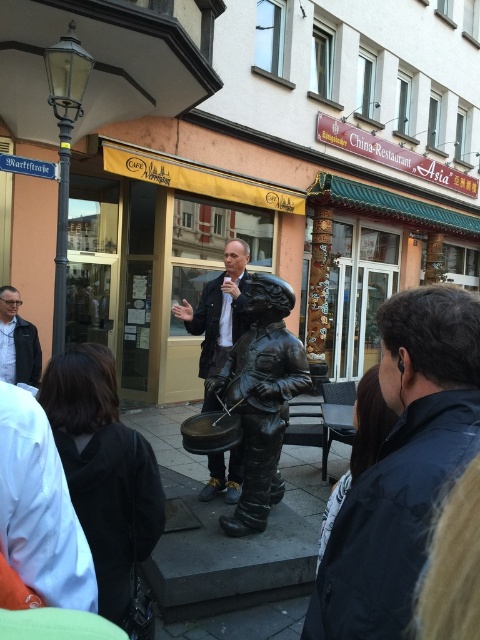
Is black fabric at lower left shorter than bronze statue at center?

Yes.

How much distance is there between black fabric at lower left and bronze statue at center?

black fabric at lower left and bronze statue at center are 1.73 meters apart from each other.

Is point (72, 483) positioned after point (276, 384)?

No, it is not.

I want to click on black fabric at lower left, so click(x=104, y=470).

Does point (292, 572) come behind point (225, 262)?

No, (292, 572) is closer to viewer.

Between black stone statue at center and matte black jacket at center, which one is positioned higher?

matte black jacket at center is higher up.

Locate an element on the screen. black stone statue at center is located at coordinates (231, 545).

Which of these two, black stone statue at center or black fabric at lower left, stands taller?

black fabric at lower left is taller.

The width and height of the screenshot is (480, 640). I want to click on black stone statue at center, so click(x=231, y=545).